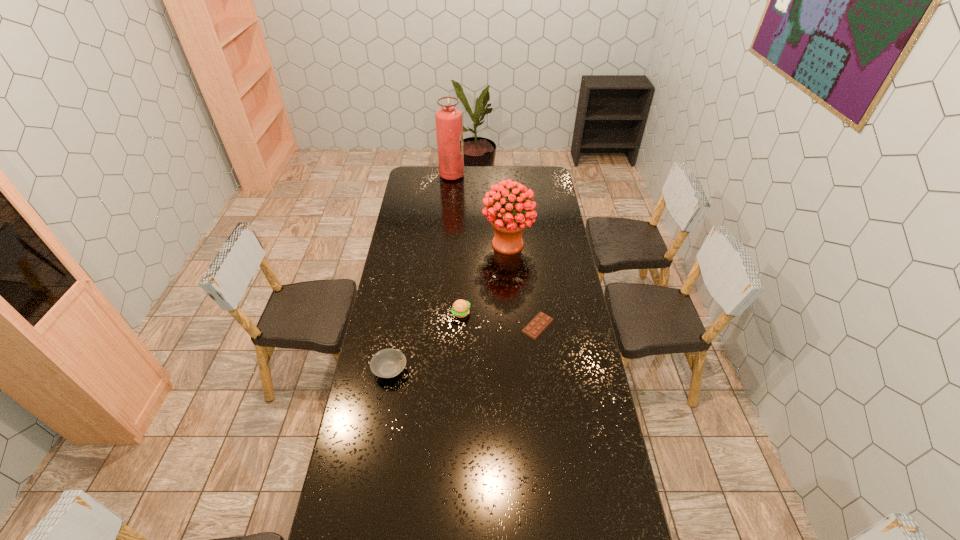
Find the location of a particular element. The width and height of the screenshot is (960, 540). the farthest object is located at coordinates (449, 122).

You are a GUI agent. You are given a task and a screenshot of the screen. Output one action in this format:
    pyautogui.click(x=<x>, y=<y>)
    Task: Click on the fire extinguisher
    This screenshot has height=540, width=960.
    Given the screenshot: What is the action you would take?
    pyautogui.click(x=449, y=122)

This screenshot has width=960, height=540. What are the coordinates of `the second farthest object` in the screenshot? It's located at (508, 222).

This screenshot has height=540, width=960. What are the coordinates of `bouquet` in the screenshot? It's located at (508, 222).

I want to click on the third shortest object, so 460,308.

Locate an element on the screen. This screenshot has height=540, width=960. bowl is located at coordinates (387, 363).

The height and width of the screenshot is (540, 960). Identify the location of the leftmost object. (387, 363).

Where is `the shortest object`? Image resolution: width=960 pixels, height=540 pixels. the shortest object is located at coordinates (541, 321).

Where is `free space located 0.090m on the label side of the farthest object`? free space located 0.090m on the label side of the farthest object is located at coordinates (479, 176).

Where is `vacant space located 0.160m on the front of the bouquet`? This screenshot has height=540, width=960. vacant space located 0.160m on the front of the bouquet is located at coordinates (510, 283).